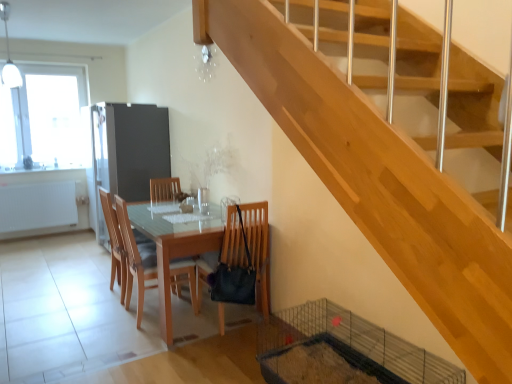
Question: Based on their positions, is wooden chair at center, the 2th chair in the right-to-left sequence, located to the left or right of matte wooden table at center?

Choices:
 (A) right
 (B) left

Answer: (B)

Question: From the image's perspective, is wooden chair at center, the 2th chair in the right-to-left sequence, located above or below matte wooden table at center?

Choices:
 (A) below
 (B) above

Answer: (B)

Question: Which is nearer to the wooden chair at center, positioned as the 1th chair in right-to-left order?

Choices:
 (A) matte wooden table at center
 (B) metallic silver screen door at center left
 (C) wooden chair at center, the 2th chair from the left
 (D) transparent glass window at upper left
 (E) wooden chair at center, which is counted as the third chair, starting from the right

Answer: (A)

Question: Which object is positioned closest to the wooden chair at center, which is counted as the third chair, starting from the right?

Choices:
 (A) wooden chair at center, which ranks as the 3th chair in left-to-right order
 (B) wooden chair at center, the 2th chair from the left
 (C) matte wooden table at center
 (D) transparent glass window at upper left
 (E) metallic silver screen door at center left

Answer: (B)